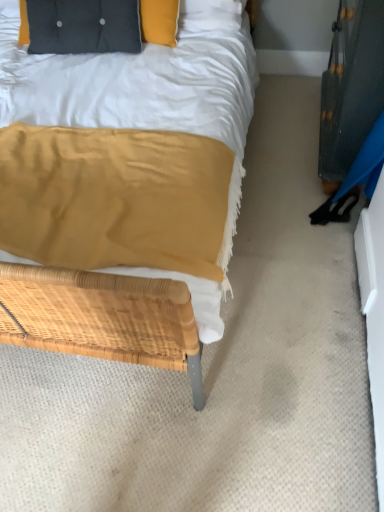
The image size is (384, 512). I want to click on black glossy dresser at right, so (351, 85).

The width and height of the screenshot is (384, 512). What do you see at coordinates (351, 85) in the screenshot?
I see `black glossy dresser at right` at bounding box center [351, 85].

In order to click on black tufted pillow at upper left in this screenshot , I will do `click(83, 26)`.

Describe the element at coordinates (83, 26) in the screenshot. This screenshot has width=384, height=512. I see `black tufted pillow at upper left` at that location.

Measure the distance between point (72, 18) and camera.

The depth of point (72, 18) is 1.99 meters.

The width and height of the screenshot is (384, 512). In order to click on black glossy dresser at right in this screenshot , I will do `click(351, 85)`.

In the image, is black tufted pillow at upper left on the left side or the right side of black glossy dresser at right?

Based on their positions, black tufted pillow at upper left is located to the left of black glossy dresser at right.

Which object is closer to the camera, black tufted pillow at upper left or black glossy dresser at right?

black glossy dresser at right is closer to the camera.

Which is closer to the camera, [110,36] or [382,73]?

Point [110,36] appears to be farther away from the viewer than point [382,73].

From the image's perspective, is black tufted pillow at upper left under black glossy dresser at right?

Actually, black tufted pillow at upper left appears above black glossy dresser at right in the image.

From a real-world perspective, which is physically above, black tufted pillow at upper left or black glossy dresser at right?

black tufted pillow at upper left.

From the picture: Can you confirm if black tufted pillow at upper left is wider than black glossy dresser at right?

Correct, the width of black tufted pillow at upper left exceeds that of black glossy dresser at right.

Does black tufted pillow at upper left have a greater height compared to black glossy dresser at right?

In fact, black tufted pillow at upper left may be shorter than black glossy dresser at right.

Which of these two, black tufted pillow at upper left or black glossy dresser at right, is bigger?

black tufted pillow at upper left is bigger.

Is black tufted pillow at upper left located outside black glossy dresser at right?

black tufted pillow at upper left lies outside black glossy dresser at right's area.

Is black tufted pillow at upper left far away from black glossy dresser at right?

Absolutely, black tufted pillow at upper left is distant from black glossy dresser at right.

Is black tufted pillow at upper left looking in the opposite direction of black glossy dresser at right?

No, black tufted pillow at upper left's orientation is not away from black glossy dresser at right.

Can you tell me how much black tufted pillow at upper left and black glossy dresser at right differ in facing direction?

They differ by 84.4 degrees in their facing directions.

What are the coordinates of `dresser located underneath the black tufted pillow at upper left (from a real-world perspective)` in the screenshot? It's located at coord(351,85).

Based on their positions, is black glossy dresser at right located to the left or right of black tufted pillow at upper left?

black glossy dresser at right is to the right of black tufted pillow at upper left.

Considering their positions, is black glossy dresser at right located in front of or behind black tufted pillow at upper left?

In the image, black glossy dresser at right appears in front of black tufted pillow at upper left.

Considering the points (351, 91) and (21, 11), which point is in front, point (351, 91) or point (21, 11)?

The point (351, 91) is closer.

From the image's perspective, relative to black tufted pillow at upper left, is black glossy dresser at right above or below?

black glossy dresser at right is situated lower than black tufted pillow at upper left in the image.

From a real-world perspective, who is located higher, black glossy dresser at right or black tufted pillow at upper left?

In real-world perspective, black tufted pillow at upper left is above.

Can you confirm if black glossy dresser at right is wider than black tufted pillow at upper left?

No.

From their relative heights in the image, would you say black glossy dresser at right is taller or shorter than black tufted pillow at upper left?

In the image, black glossy dresser at right appears to be taller than black tufted pillow at upper left.

Can you confirm if black glossy dresser at right is smaller than black tufted pillow at upper left?

Yes, black glossy dresser at right is smaller than black tufted pillow at upper left.

Choose the correct answer: Is black glossy dresser at right inside black tufted pillow at upper left or outside it?

black glossy dresser at right exists outside the volume of black tufted pillow at upper left.

Would you say black glossy dresser at right is a long distance from black tufted pillow at upper left?

Yes, black glossy dresser at right and black tufted pillow at upper left are located far from each other.

Is black glossy dresser at right looking in the opposite direction of black tufted pillow at upper left?

No, black glossy dresser at right is not facing the opposite direction of black tufted pillow at upper left.

At what (x,y) coordinates should I click in order to perform the action: click on dresser below the black tufted pillow at upper left (from the image's perspective). Please return your answer as a coordinate pair (x, y). This screenshot has width=384, height=512. Looking at the image, I should click on (351, 85).

Where is `pillow lying behind the black glossy dresser at right`? The height and width of the screenshot is (512, 384). pillow lying behind the black glossy dresser at right is located at coordinates pos(83,26).

The height and width of the screenshot is (512, 384). Find the location of `pillow above the black glossy dresser at right (from a real-world perspective)`. pillow above the black glossy dresser at right (from a real-world perspective) is located at coordinates tap(83, 26).